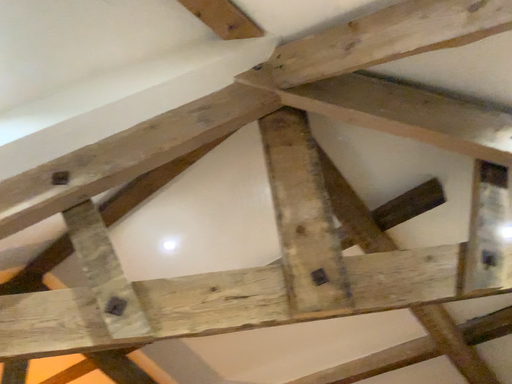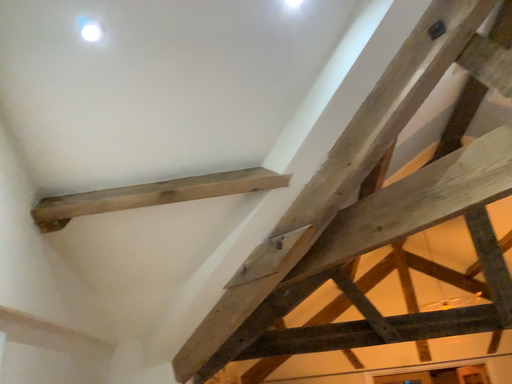
Question: How did the camera likely rotate when shooting the video?

Choices:
 (A) rotated downward
 (B) rotated upward

Answer: (A)